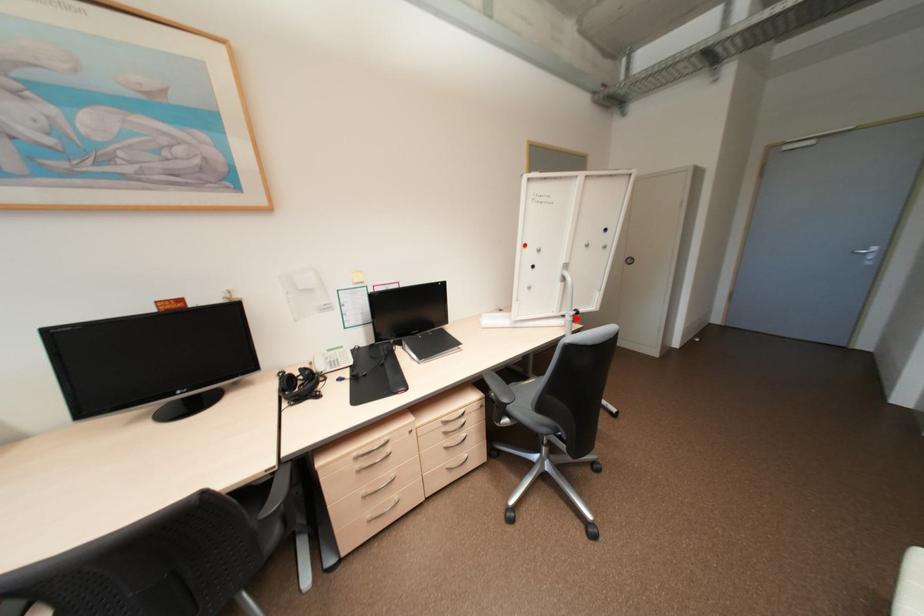
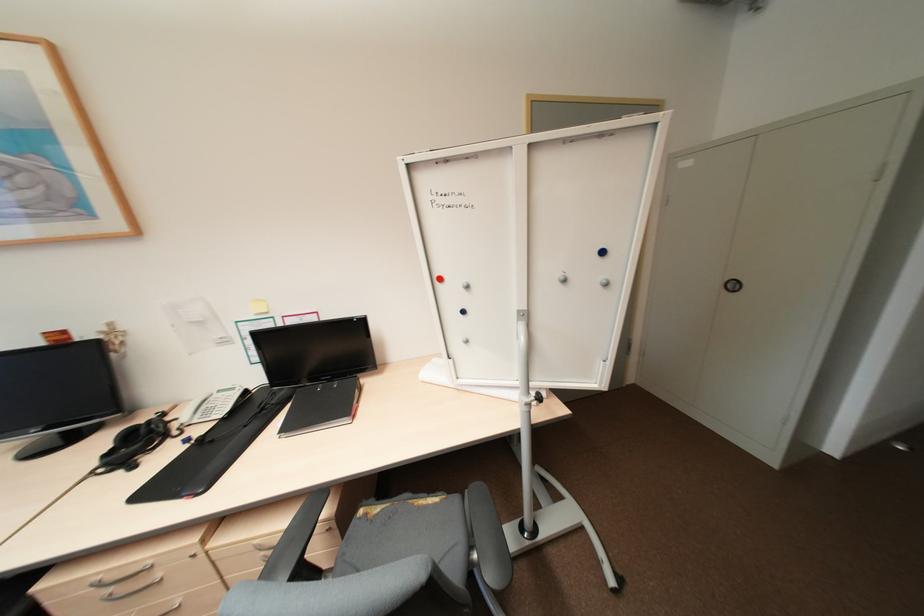
Where in the second image is the point corresponding to the highlighted location from the first image?

(531, 408)